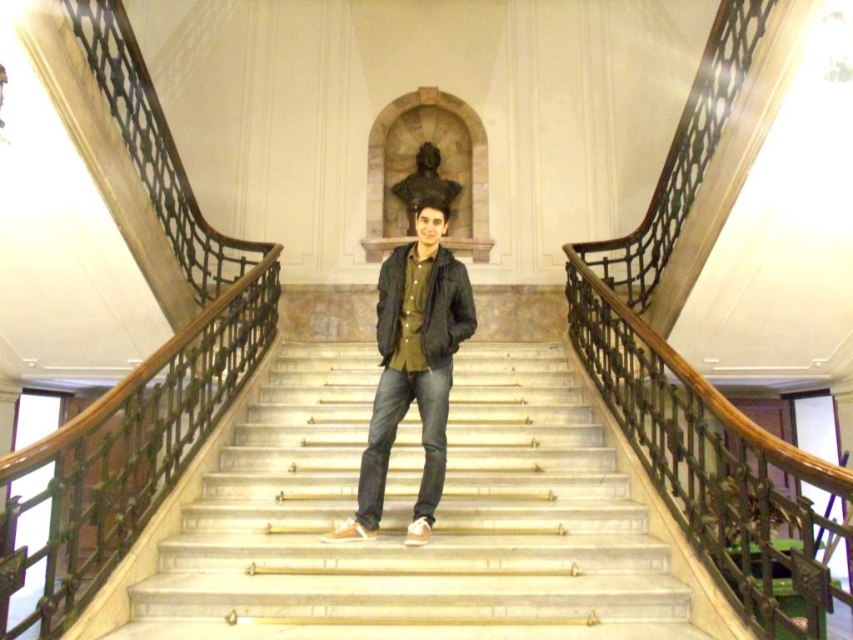
Does dark green fabric jacket at center appear on the right side of dark green matte jacket at center?

No, dark green fabric jacket at center is not to the right of dark green matte jacket at center.

This screenshot has width=853, height=640. Describe the element at coordinates (413, 365) in the screenshot. I see `dark green fabric jacket at center` at that location.

Is point (436, 307) less distant than point (376, 348)?

That is True.

Where is `dark green fabric jacket at center`? dark green fabric jacket at center is located at coordinates (413, 365).

Who is more forward, (434, 598) or (448, 349)?

Positioned in front is point (434, 598).

Does point (456, 612) come behind point (437, 340)?

No, it is in front of (437, 340).

The height and width of the screenshot is (640, 853). I want to click on white marble stairs at center, so click(x=409, y=516).

This screenshot has width=853, height=640. What are the coordinates of `white marble stairs at center` in the screenshot? It's located at (409, 516).

At what (x,y) coordinates should I click in order to perform the action: click on white marble stairs at center. Please return your answer as a coordinate pair (x, y). Looking at the image, I should click on (409, 516).

Does point (556, 497) lie behind point (407, 298)?

Yes, it is behind point (407, 298).

Identify the location of white marble stairs at center. (409, 516).